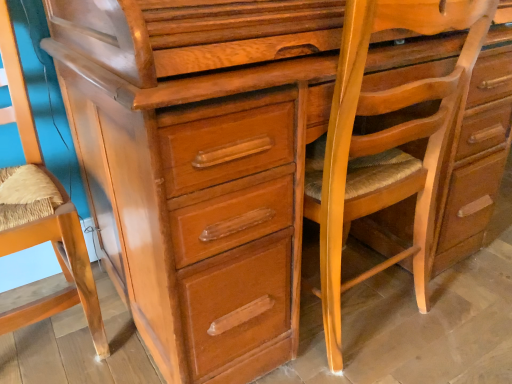
Question: Is light brown wood rocking chair at center bigger than wooden textured swivel chair at left?

Choices:
 (A) yes
 (B) no

Answer: (A)

Question: Is light brown wood rocking chair at center wider than wooden textured swivel chair at left?

Choices:
 (A) yes
 (B) no

Answer: (B)

Question: Is light brown wood rocking chair at center not close to wooden textured swivel chair at left?

Choices:
 (A) no
 (B) yes

Answer: (A)

Question: Considering the relative positions of light brown wood rocking chair at center and wooden textured swivel chair at left in the image provided, is light brown wood rocking chair at center in front of wooden textured swivel chair at left?

Choices:
 (A) yes
 (B) no

Answer: (B)

Question: From the image's perspective, is light brown wood rocking chair at center on wooden textured swivel chair at left?

Choices:
 (A) yes
 (B) no

Answer: (A)

Question: From a real-world perspective, is light brown wood rocking chair at center located beneath wooden textured swivel chair at left?

Choices:
 (A) yes
 (B) no

Answer: (B)

Question: Considering the relative sizes of wooden textured swivel chair at left and light brown wood rocking chair at center in the image provided, is wooden textured swivel chair at left taller than light brown wood rocking chair at center?

Choices:
 (A) yes
 (B) no

Answer: (A)

Question: Is wooden textured swivel chair at left wider than light brown wood rocking chair at center?

Choices:
 (A) no
 (B) yes

Answer: (B)

Question: From the image's perspective, is wooden textured swivel chair at left located above light brown wood rocking chair at center?

Choices:
 (A) no
 (B) yes

Answer: (A)

Question: Is wooden textured swivel chair at left positioned far away from light brown wood rocking chair at center?

Choices:
 (A) yes
 (B) no

Answer: (B)

Question: From a real-world perspective, is wooden textured swivel chair at left located beneath light brown wood rocking chair at center?

Choices:
 (A) yes
 (B) no

Answer: (A)

Question: From a real-world perspective, is wooden textured swivel chair at left on light brown wood rocking chair at center?

Choices:
 (A) no
 (B) yes

Answer: (A)

Question: Considering the positions of wooden textured swivel chair at left and light brown wood rocking chair at center in the image, is wooden textured swivel chair at left wider or thinner than light brown wood rocking chair at center?

Choices:
 (A) thin
 (B) wide

Answer: (B)